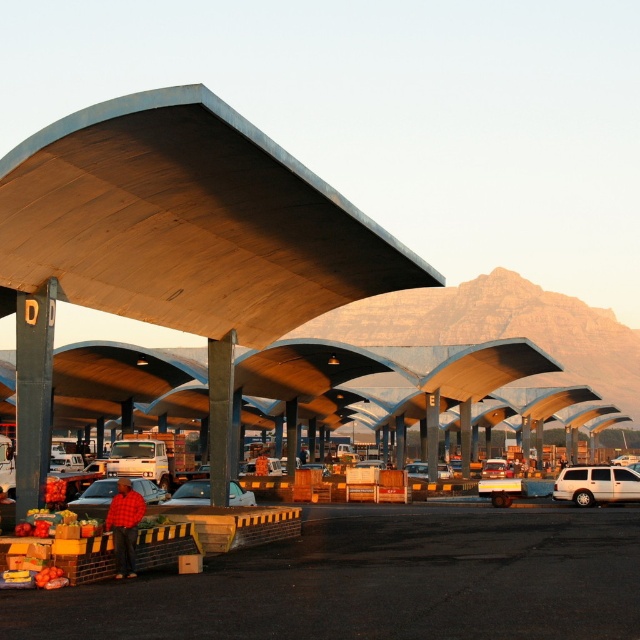
You are standing at the entrance of the market and want to reach the point marked as point (618, 481). Considering your walking speed is 3 feet per second, how many seconds will it take you to reach the point?

The point (618, 481) is 126.77 feet away from the viewer. At a walking speed of 3 feet per second, it will take approximately 42.26 seconds to reach the point.

You are a customer at the market and want to buy apples. You notice the shiny red apples at lower left and the matte black car at center. Which object is closer to you based on their sizes?

The shiny red apples at lower left are closer to you because the matte black car at center has a smaller size compared to shiny red apples at lower left, indicating the apples are nearer.